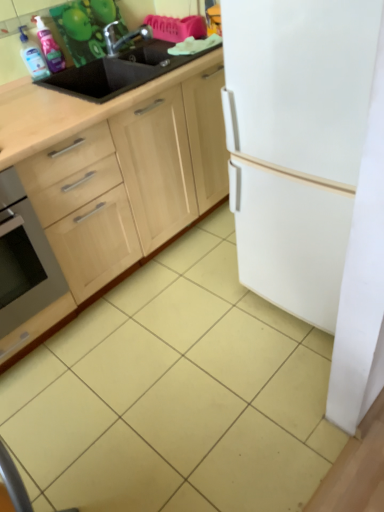
Question: Is black matte sink at upper left bigger or smaller than translucent plastic spray bottle at upper left, marked as the first cleaning product in a right-to-left arrangement?

Choices:
 (A) small
 (B) big

Answer: (B)

Question: In the image, is black matte sink at upper left positioned in front of or behind translucent plastic spray bottle at upper left, marked as the first cleaning product in a right-to-left arrangement?

Choices:
 (A) behind
 (B) front

Answer: (B)

Question: Which of these objects is positioned farthest from the stainless steel oven at lower left?

Choices:
 (A) black matte sink at upper left
 (B) white matte refrigerator at right
 (C) wooden cabinet at center
 (D) metallic silver faucet at upper left
 (E) translucent plastic spray bottle at upper left, marked as the 2th cleaning product in a left-to-right arrangement

Answer: (D)

Question: Which object is the farthest from the yellow matte tile at lower left?

Choices:
 (A) translucent plastic spray bottle at upper left, marked as the 2th cleaning product in a left-to-right arrangement
 (B) black matte sink at upper left
 (C) stainless steel oven at lower left
 (D) metallic silver faucet at upper left
 (E) translucent plastic bottle at upper left, the second cleaning product when ordered from right to left

Answer: (D)